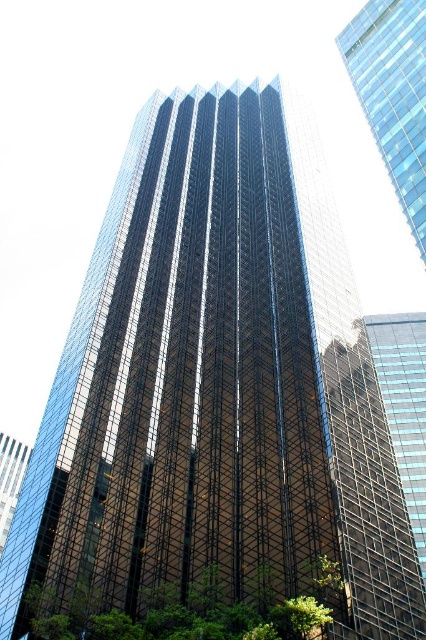
Does transparent glass skyscraper at upper right have a larger size compared to green leafy tree at lower right?

Yes, transparent glass skyscraper at upper right is bigger than green leafy tree at lower right.

Is transparent glass skyscraper at upper right above green leafy tree at lower right?

Yes, transparent glass skyscraper at upper right is above green leafy tree at lower right.

The image size is (426, 640). I want to click on transparent glass skyscraper at upper right, so click(x=393, y=93).

Image resolution: width=426 pixels, height=640 pixels. In order to click on transparent glass skyscraper at upper right in this screenshot , I will do `click(393, 93)`.

Is transparent glass skyscraper at upper right above green leafy tree at lower left?

Indeed, transparent glass skyscraper at upper right is positioned over green leafy tree at lower left.

Is transparent glass skyscraper at upper right to the left of green leafy tree at lower left from the viewer's perspective?

In fact, transparent glass skyscraper at upper right is to the right of green leafy tree at lower left.

At what (x,y) coordinates should I click in order to perform the action: click on transparent glass skyscraper at upper right. Please return your answer as a coordinate pair (x, y). The image size is (426, 640). Looking at the image, I should click on (393, 93).

Image resolution: width=426 pixels, height=640 pixels. Find the location of `transparent glass skyscraper at upper right`. transparent glass skyscraper at upper right is located at coordinates (393, 93).

Does green leafy tree at lower left have a greater height compared to green leafy tree at lower right?

Yes.

Is point (250, 630) positioned after point (307, 636)?

No, it is not.

This screenshot has width=426, height=640. Identify the location of green leafy tree at lower left. (198, 616).